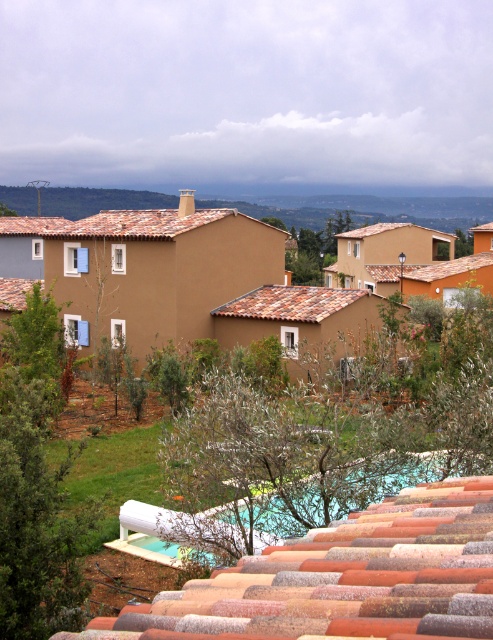
Does terracotta tile roof at center have a smaller size compared to brown clay tiles at left?

Yes.

Is the position of terracotta tile roof at center more distant than that of brown clay tiles at left?

No, it is in front of brown clay tiles at left.

Locate an element on the screen. terracotta tile roof at center is located at coordinates (289, 301).

Between green leafy tree at left and terracotta tile roof at center, which one appears on the left side from the viewer's perspective?

green leafy tree at left is more to the left.

Is green leafy tree at left to the right of terracotta tile roof at center from the viewer's perspective?

No, green leafy tree at left is not to the right of terracotta tile roof at center.

Does point (18, 340) lie in front of point (281, 288)?

Yes.

You are a GUI agent. You are given a task and a screenshot of the screen. Output one action in this format:
    pyautogui.click(x=<x>, y=<y>)
    Task: Click on the green leafy tree at left
    
    Given the screenshot: What is the action you would take?
    pyautogui.click(x=35, y=337)

Does green leafy tree at lower left have a lesser width compared to brown clay tiles at left?

Correct, green leafy tree at lower left's width is less than brown clay tiles at left's.

Does green leafy tree at lower left appear on the right side of brown clay tiles at left?

Correct, you'll find green leafy tree at lower left to the right of brown clay tiles at left.

Which is in front, point (6, 438) or point (2, 294)?

Point (6, 438) is more forward.

Where is `green leafy tree at lower left`? The image size is (493, 640). green leafy tree at lower left is located at coordinates (35, 518).